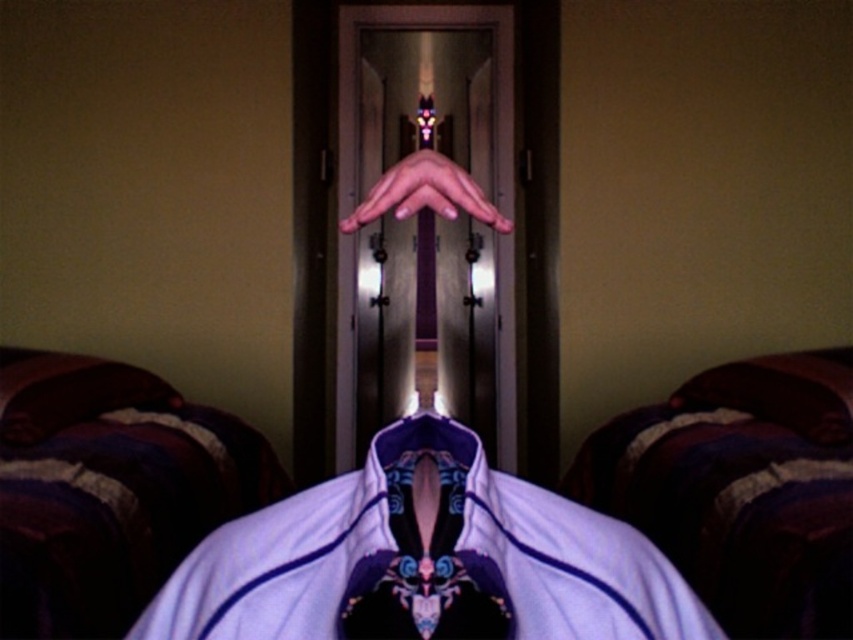
Question: From the image, what is the correct spatial relationship of purple satin robe at center in relation to matte purple hand at center?

Choices:
 (A) left
 (B) right

Answer: (A)

Question: Which object is farther from the camera taking this photo?

Choices:
 (A) matte purple hand at center
 (B) purple satin robe at center

Answer: (A)

Question: From the image, what is the correct spatial relationship of purple satin robe at center in relation to white satin dress shirt at center?

Choices:
 (A) left
 (B) right

Answer: (B)

Question: From the image, what is the correct spatial relationship of purple satin robe at center in relation to white satin dress shirt at center?

Choices:
 (A) above
 (B) below

Answer: (B)

Question: Which is farther from the purple satin robe at center?

Choices:
 (A) matte purple hand at center
 (B) white satin dress shirt at center

Answer: (A)

Question: Among these objects, which one is nearest to the camera?

Choices:
 (A) purple satin robe at center
 (B) matte purple hand at center

Answer: (A)